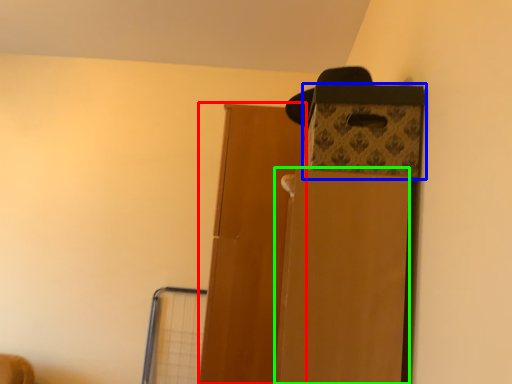
Question: Considering the real-world distances, which object is farthest from door (highlighted by a red box)? storage box (highlighted by a blue box) or cardboard box (highlighted by a green box)?

Choices:
 (A) storage box
 (B) cardboard box

Answer: (B)